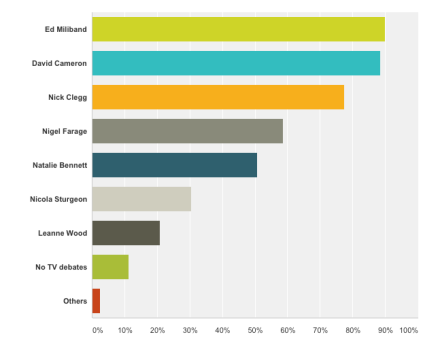
Identify the location of dark grey bar. The height and width of the screenshot is (358, 440). (253, 130).